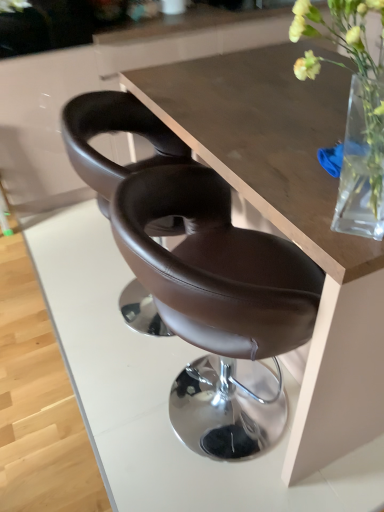
Image resolution: width=384 pixels, height=512 pixels. I want to click on vacant space that is to the left of brown leather chair at center, positioned as the 1th chair in back-to-front order, so click(x=57, y=311).